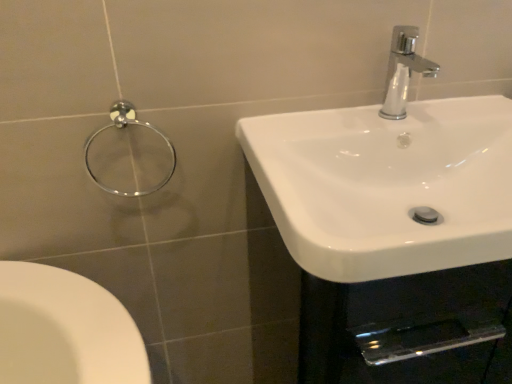
Question: From a real-world perspective, is chrome metallic faucet at upper right over white glossy sink at right?

Choices:
 (A) yes
 (B) no

Answer: (A)

Question: Would you say chrome metallic faucet at upper right is a long distance from white glossy sink at right?

Choices:
 (A) no
 (B) yes

Answer: (A)

Question: Is white glossy sink at right at the back of chrome metallic faucet at upper right?

Choices:
 (A) no
 (B) yes

Answer: (A)

Question: Is chrome metallic faucet at upper right thinner than white glossy sink at right?

Choices:
 (A) no
 (B) yes

Answer: (B)

Question: Is chrome metallic faucet at upper right taller than white glossy sink at right?

Choices:
 (A) yes
 (B) no

Answer: (A)

Question: Considering the relative positions of chrome metallic faucet at upper right and white glossy sink at right in the image provided, is chrome metallic faucet at upper right to the left or to the right of white glossy sink at right?

Choices:
 (A) left
 (B) right

Answer: (A)

Question: Looking at their shapes, would you say chrome metallic faucet at upper right is wider or thinner than white glossy sink at right?

Choices:
 (A) thin
 (B) wide

Answer: (A)

Question: From a real-world perspective, is chrome metallic faucet at upper right above or below white glossy sink at right?

Choices:
 (A) below
 (B) above

Answer: (B)

Question: Is chrome metallic faucet at upper right in front of or behind white glossy sink at right in the image?

Choices:
 (A) front
 (B) behind

Answer: (B)

Question: From a real-world perspective, is white glossy sink at right physically located above or below chrome metallic towel ring at upper left?

Choices:
 (A) above
 (B) below

Answer: (B)

Question: Is point (510, 170) positioned closer to the camera than point (88, 162)?

Choices:
 (A) farther
 (B) closer

Answer: (B)

Question: Is white glossy sink at right to the left or to the right of chrome metallic towel ring at upper left in the image?

Choices:
 (A) right
 (B) left

Answer: (A)

Question: Would you say white glossy sink at right is inside or outside chrome metallic towel ring at upper left?

Choices:
 (A) inside
 (B) outside

Answer: (B)

Question: Would you say chrome metallic towel ring at upper left is to the left or to the right of chrome metallic faucet at upper right in the picture?

Choices:
 (A) right
 (B) left

Answer: (B)

Question: From the image's perspective, is chrome metallic towel ring at upper left located above or below chrome metallic faucet at upper right?

Choices:
 (A) above
 (B) below

Answer: (B)